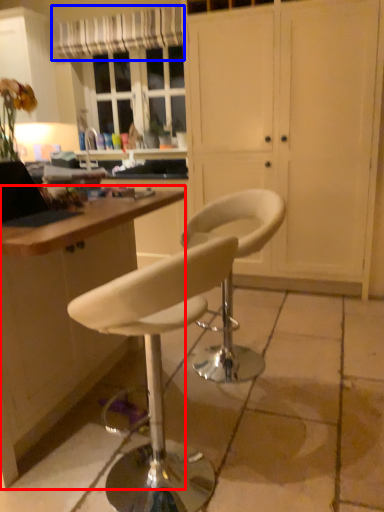
Question: Which object appears closest to the camera in this image, desk (highlighted by a red box) or curtain (highlighted by a blue box)?

Choices:
 (A) desk
 (B) curtain

Answer: (A)